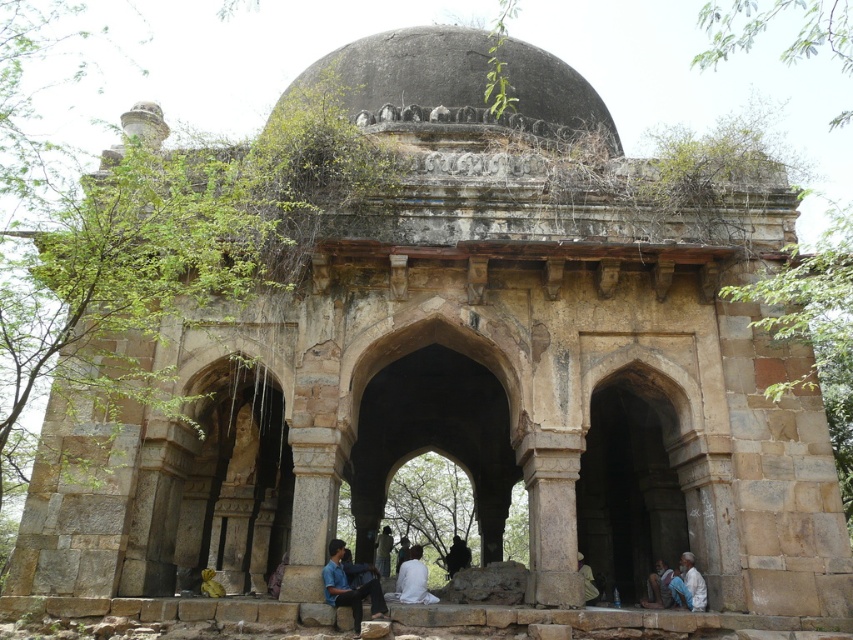
Identify the location of blue shirt at lower center. The image size is (853, 640). (349, 588).

Does blue shirt at lower center have a larger size compared to light brown fabric at lower center?

Actually, blue shirt at lower center might be smaller than light brown fabric at lower center.

Where is `blue shirt at lower center`? The width and height of the screenshot is (853, 640). blue shirt at lower center is located at coordinates (349, 588).

Between light beige stone man at lower right and light brown fabric at lower center, which one appears on the left side from the viewer's perspective?

light brown fabric at lower center

Which of these two, light beige stone man at lower right or light brown fabric at lower center, stands taller?

Standing taller between the two is light brown fabric at lower center.

Which is behind, point (685, 589) or point (654, 568)?

Positioned behind is point (654, 568).

At what (x,y) coordinates should I click in order to perform the action: click on light beige stone man at lower right. Please return your answer as a coordinate pair (x, y). This screenshot has height=640, width=853. Looking at the image, I should click on (688, 586).

Is point (418, 556) positioned in front of point (589, 588)?

No, (418, 556) is behind (589, 588).

Measure the distance between point (399, 566) and camera.

Point (399, 566) and camera are 219.35 feet apart from each other.

I want to click on white fabric cloth at center, so click(412, 579).